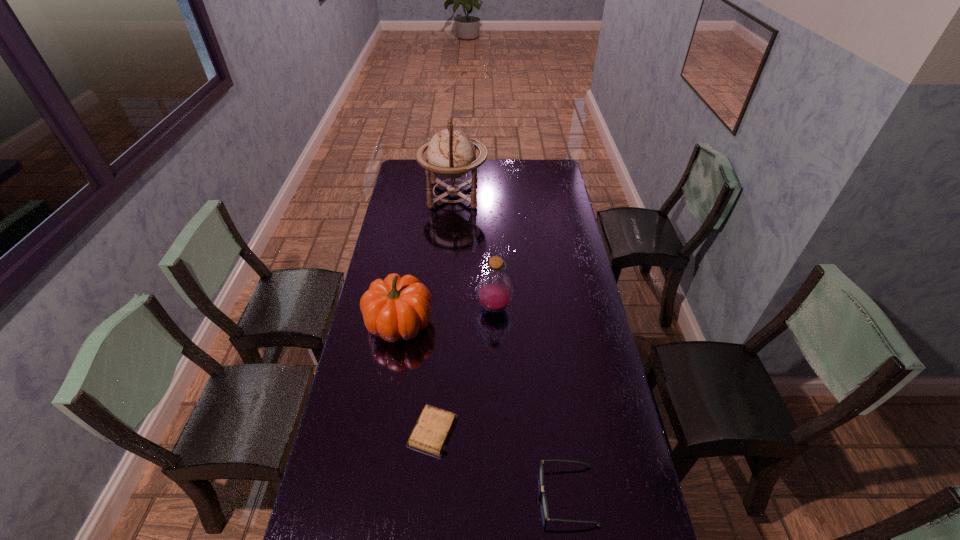
Locate an element on the screen. free space between the tallest object and the spectacles is located at coordinates (511, 346).

Image resolution: width=960 pixels, height=540 pixels. I want to click on free area in between the diary and the bottle, so click(x=464, y=369).

This screenshot has height=540, width=960. Identify the location of vacant space that is in between the pumpkin and the globe. (426, 259).

Identify the location of the third closest object to the globe. (434, 426).

Locate an element on the screen. The width and height of the screenshot is (960, 540). object that is the third nearest to the second shortest object is located at coordinates (495, 290).

Image resolution: width=960 pixels, height=540 pixels. Find the location of `free space that satisfies the following two spatial constraints: 1. on the back side of the bottle; 2. on the right side of the pumpkin`. free space that satisfies the following two spatial constraints: 1. on the back side of the bottle; 2. on the right side of the pumpkin is located at coordinates (402, 308).